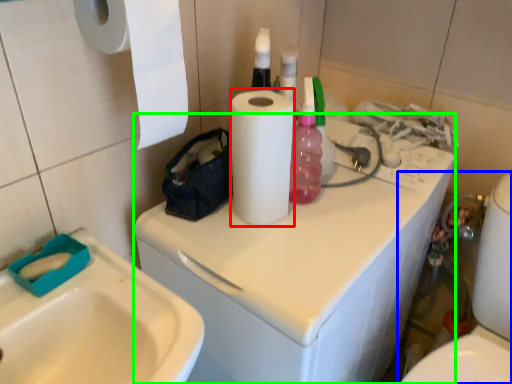
Question: Based on their relative distances, which object is farther from paper towel (highlighted by a red box)? Choose from toilet (highlighted by a blue box) and washing machine (highlighted by a green box).

Choices:
 (A) toilet
 (B) washing machine

Answer: (A)